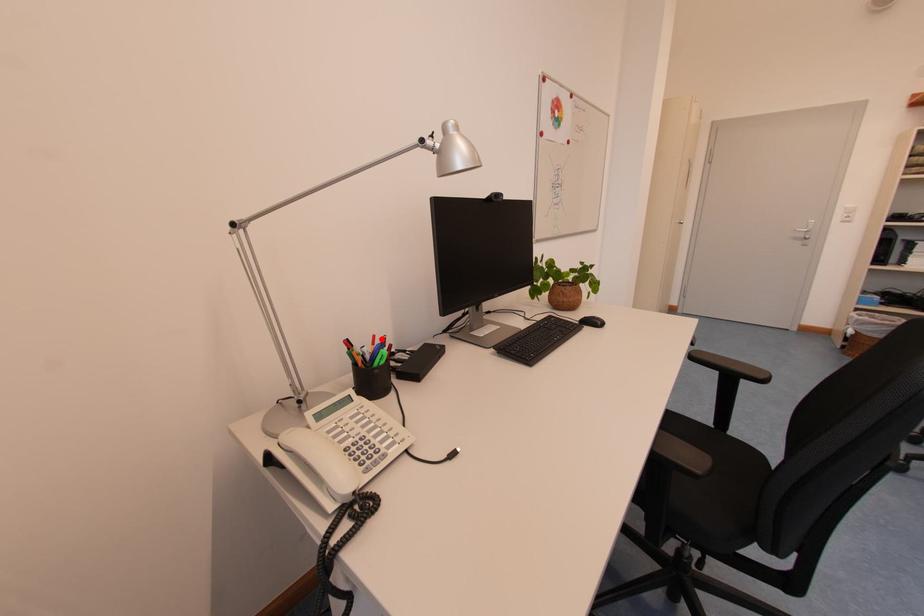
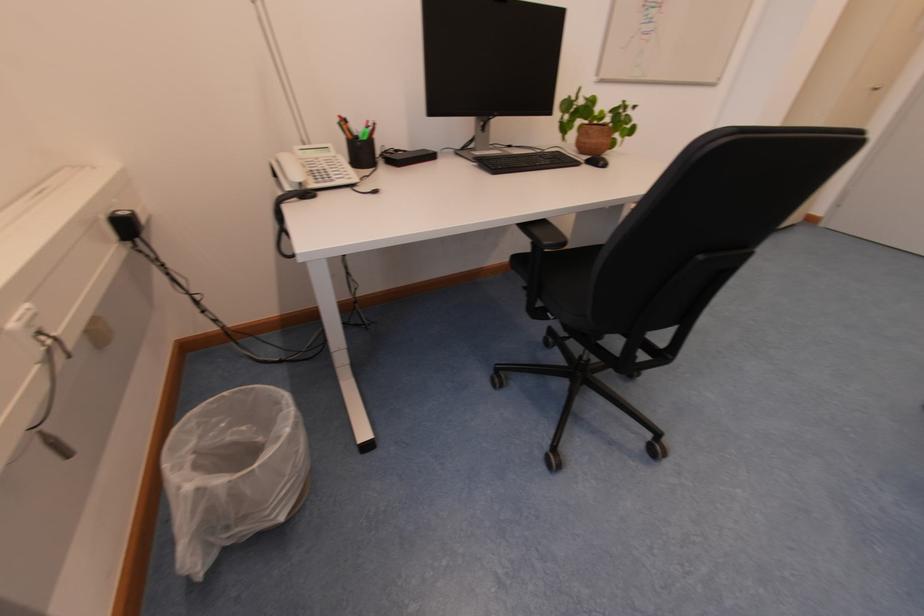
Question: A red point is marked in image1. In image2, is the corresponding 3D point closer to the camera or farther? Reply with the corresponding letter.

Choices:
 (A) The corresponding 3D point is closer.
 (B) The corresponding 3D point is farther.

Answer: (A)